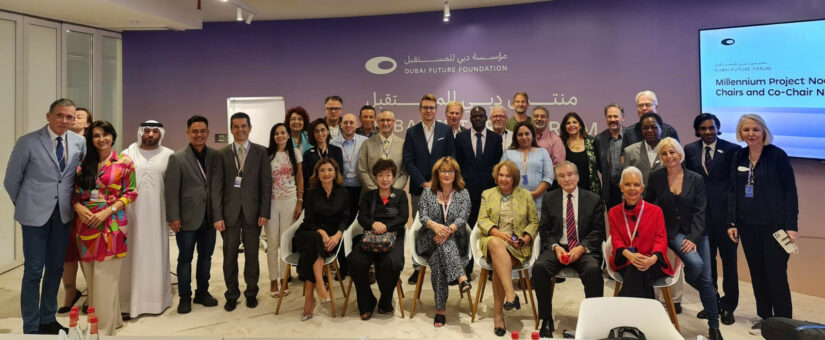
Where is `door`? door is located at coordinates (260, 126).